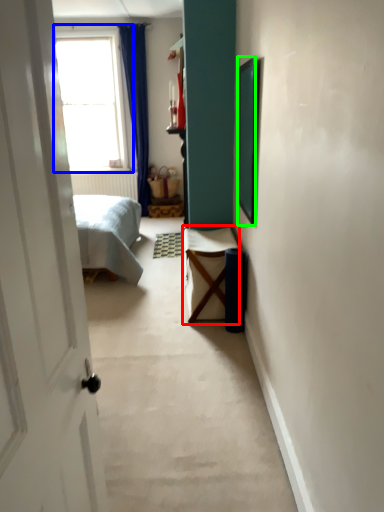
Question: Which is nearer to the furniture (highlighted by a red box)? window (highlighted by a blue box) or picture frame (highlighted by a green box).

Choices:
 (A) window
 (B) picture frame

Answer: (B)